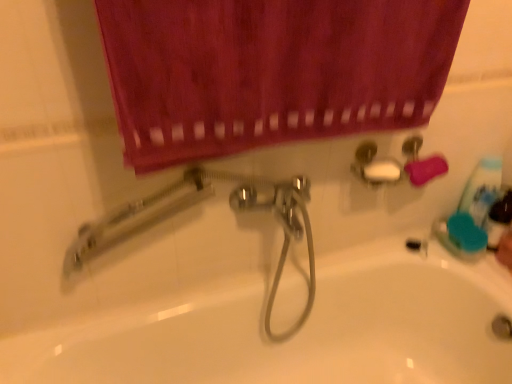
Question: Is smooth skin hand at lower right at the right side of blue plastic mouthwash at right?

Choices:
 (A) yes
 (B) no

Answer: (A)

Question: Are smooth skin hand at lower right and blue plastic mouthwash at right making contact?

Choices:
 (A) no
 (B) yes

Answer: (B)

Question: From the image's perspective, would you say smooth skin hand at lower right is positioned over blue plastic mouthwash at right?

Choices:
 (A) yes
 (B) no

Answer: (B)

Question: Is there a large distance between smooth skin hand at lower right and blue plastic mouthwash at right?

Choices:
 (A) yes
 (B) no

Answer: (B)

Question: Is smooth skin hand at lower right aimed at blue plastic mouthwash at right?

Choices:
 (A) yes
 (B) no

Answer: (B)

Question: Considering the relative positions of smooth skin hand at lower right and blue plastic mouthwash at right in the image provided, is smooth skin hand at lower right in front of blue plastic mouthwash at right?

Choices:
 (A) no
 (B) yes

Answer: (B)

Question: Is smooth skin hand at lower right to the left of velvet-like maroon curtain at upper center from the viewer's perspective?

Choices:
 (A) no
 (B) yes

Answer: (A)

Question: Does smooth skin hand at lower right have a larger size compared to velvet-like maroon curtain at upper center?

Choices:
 (A) no
 (B) yes

Answer: (A)

Question: From the image's perspective, is smooth skin hand at lower right below velvet-like maroon curtain at upper center?

Choices:
 (A) yes
 (B) no

Answer: (A)

Question: Is smooth skin hand at lower right facing towards velvet-like maroon curtain at upper center?

Choices:
 (A) yes
 (B) no

Answer: (B)

Question: Can you confirm if smooth skin hand at lower right is smaller than velvet-like maroon curtain at upper center?

Choices:
 (A) yes
 (B) no

Answer: (A)

Question: Does smooth skin hand at lower right lie behind velvet-like maroon curtain at upper center?

Choices:
 (A) no
 (B) yes

Answer: (B)

Question: Considering the relative sizes of white glossy bathtub at center and smooth skin hand at lower right in the image provided, is white glossy bathtub at center thinner than smooth skin hand at lower right?

Choices:
 (A) no
 (B) yes

Answer: (A)